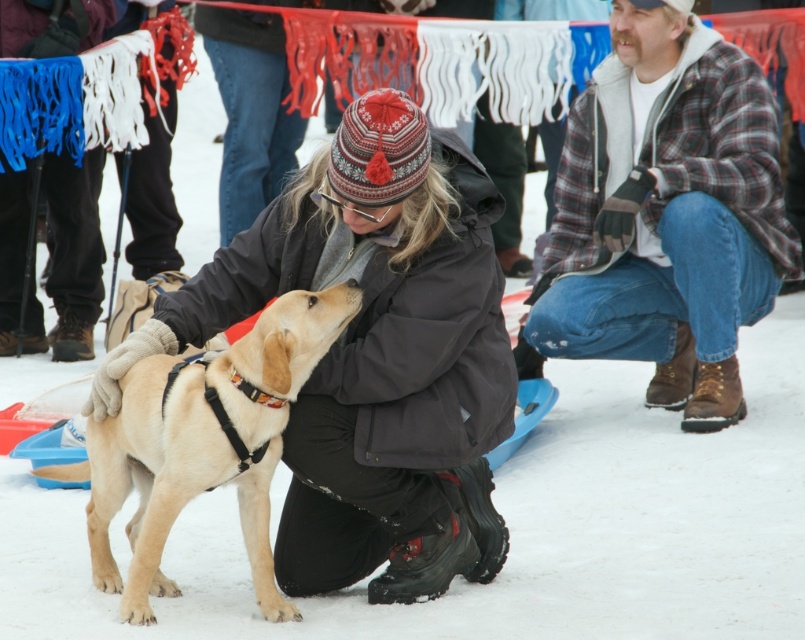
Does matte black jacket at center have a lesser width compared to plaid flannel shirt at lower right?

Incorrect, matte black jacket at center's width is not less than plaid flannel shirt at lower right's.

Between matte black jacket at center and plaid flannel shirt at lower right, which one has less height?

matte black jacket at center is shorter.

Who is more distant from viewer, (444, 314) or (725, 284)?

Positioned behind is point (725, 284).

I want to click on matte black jacket at center, so coord(374,355).

Between plaid flannel shirt at lower right and light brown fur at center, which one has less height?

With less height is light brown fur at center.

Who is positioned more to the left, plaid flannel shirt at lower right or light brown fur at center?

light brown fur at center

The image size is (805, 640). I want to click on plaid flannel shirt at lower right, so click(x=667, y=212).

Describe the element at coordinates (374, 355) in the screenshot. The height and width of the screenshot is (640, 805). I see `matte black jacket at center` at that location.

Is matte black jacket at center bigger than light brown fur at center?

Yes.

Describe the element at coordinates (374, 355) in the screenshot. Image resolution: width=805 pixels, height=640 pixels. I see `matte black jacket at center` at that location.

Image resolution: width=805 pixels, height=640 pixels. In order to click on matte black jacket at center in this screenshot , I will do `click(374, 355)`.